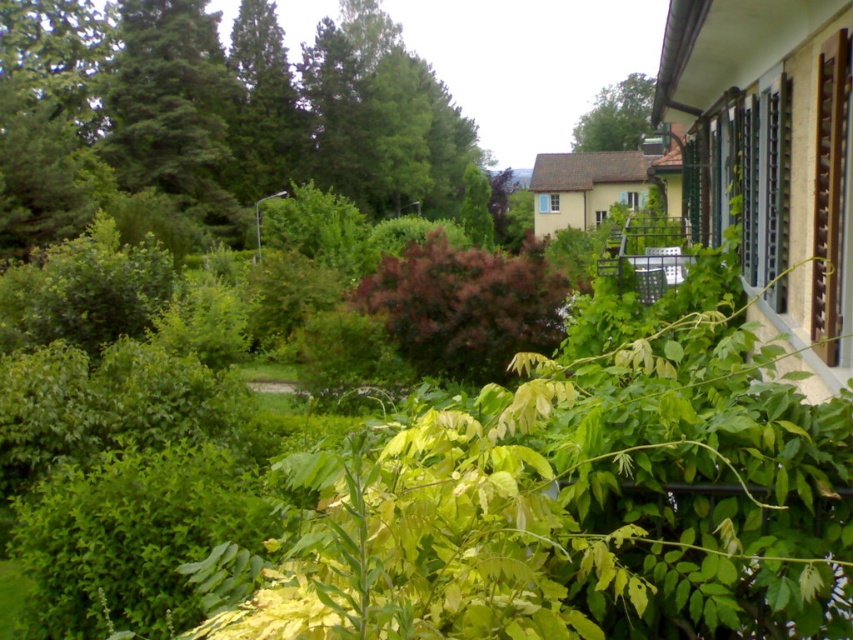
Based on the photo, between green leafy tree at upper left and purple matte bush at center, which one is positioned lower?

purple matte bush at center

I want to click on green leafy tree at upper left, so click(213, 113).

Describe the element at coordinates (213, 113) in the screenshot. I see `green leafy tree at upper left` at that location.

In order to click on green leafy tree at upper left in this screenshot , I will do `click(213, 113)`.

Does green leafy tree at upper left appear over green leafy tree at upper center?

No, green leafy tree at upper left is not above green leafy tree at upper center.

Locate an element on the screen. green leafy tree at upper left is located at coordinates (213, 113).

Between green matte tree at upper left and purple matte bush at center, which one appears on the left side from the viewer's perspective?

green matte tree at upper left is more to the left.

Which is below, green matte tree at upper left or purple matte bush at center?

purple matte bush at center

Which is in front, point (122, 132) or point (404, 269)?

Point (404, 269)

This screenshot has height=640, width=853. What are the coordinates of `green matte tree at upper left` in the screenshot? It's located at (173, 109).